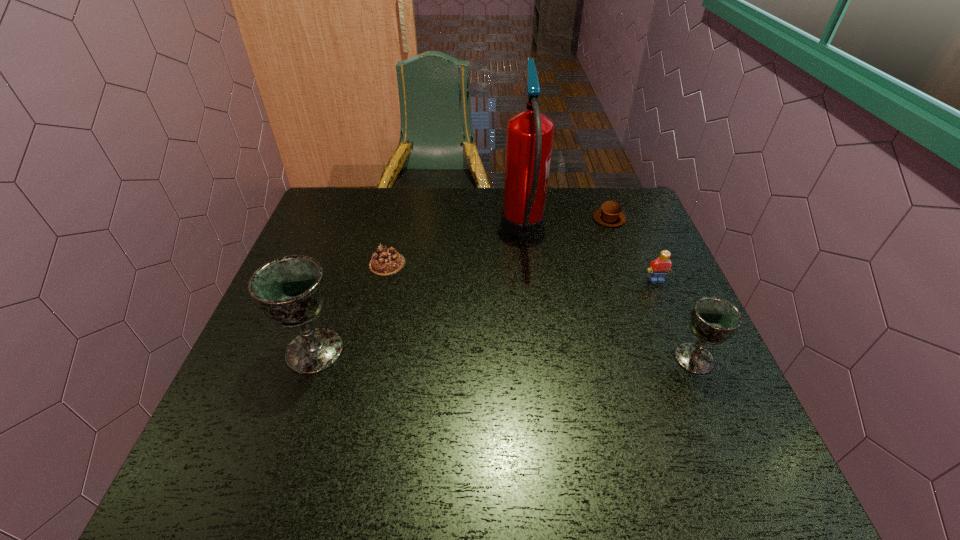
The height and width of the screenshot is (540, 960). I want to click on free space for an extra chalice to achieve even spacing, so 503,354.